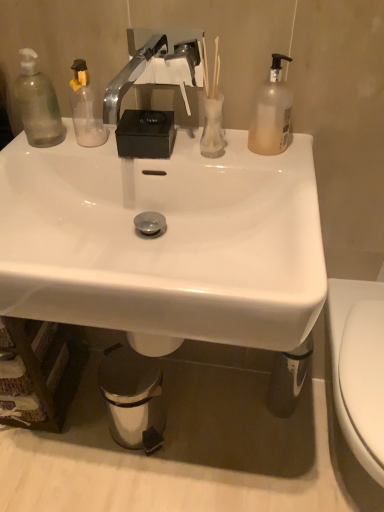
Question: Is white glossy sink at center not inside shiny metallic trash can at lower center?

Choices:
 (A) yes
 (B) no

Answer: (A)

Question: From a real-world perspective, is white glossy sink at center positioned under shiny metallic trash can at lower center based on gravity?

Choices:
 (A) no
 (B) yes

Answer: (A)

Question: From a real-world perspective, is white glossy sink at center located higher than shiny metallic trash can at lower center?

Choices:
 (A) no
 (B) yes

Answer: (B)

Question: Considering the relative sizes of white glossy sink at center and shiny metallic trash can at lower center in the image provided, is white glossy sink at center taller than shiny metallic trash can at lower center?

Choices:
 (A) no
 (B) yes

Answer: (B)

Question: Is white glossy sink at center shorter than shiny metallic trash can at lower center?

Choices:
 (A) no
 (B) yes

Answer: (A)

Question: Is white glossy sink at center not close to shiny metallic trash can at lower center?

Choices:
 (A) no
 (B) yes

Answer: (A)

Question: Is translucent plastic bottle at upper right, placed as the 2th bottle when sorted from left to right, positioned beyond the bounds of chrome metallic faucet at upper center?

Choices:
 (A) no
 (B) yes

Answer: (B)

Question: Considering the relative sizes of translucent plastic bottle at upper right, placed as the 2th bottle when sorted from left to right, and chrome metallic faucet at upper center in the image provided, is translucent plastic bottle at upper right, placed as the 2th bottle when sorted from left to right, wider than chrome metallic faucet at upper center?

Choices:
 (A) no
 (B) yes

Answer: (A)

Question: Is translucent plastic bottle at upper right, placed as the first bottle when sorted from right to left, bigger than chrome metallic faucet at upper center?

Choices:
 (A) no
 (B) yes

Answer: (A)

Question: Is there a large distance between translucent plastic bottle at upper right, placed as the first bottle when sorted from right to left, and chrome metallic faucet at upper center?

Choices:
 (A) no
 (B) yes

Answer: (A)

Question: Is translucent plastic bottle at upper right, placed as the first bottle when sorted from right to left, positioned in front of chrome metallic faucet at upper center?

Choices:
 (A) no
 (B) yes

Answer: (A)

Question: Considering the relative sizes of translucent plastic bottle at upper right, placed as the first bottle when sorted from right to left, and chrome metallic faucet at upper center in the image provided, is translucent plastic bottle at upper right, placed as the first bottle when sorted from right to left, smaller than chrome metallic faucet at upper center?

Choices:
 (A) no
 (B) yes

Answer: (B)

Question: Does white glossy sink at center touch white glossy toilet at right?

Choices:
 (A) yes
 (B) no

Answer: (B)